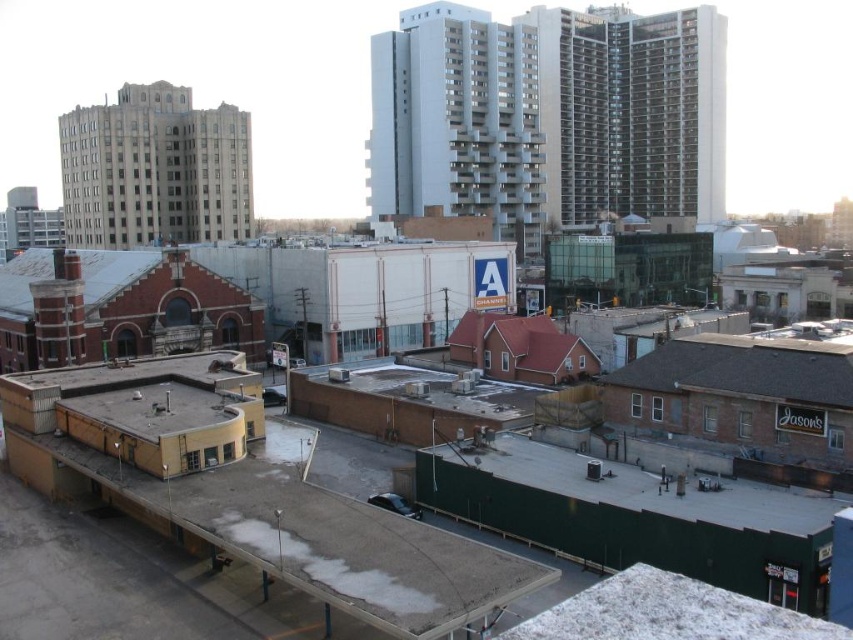
Where is `green matte wall at lower center`? green matte wall at lower center is located at coordinates (646, 486).

Who is more forward, (x=492, y=442) or (x=782, y=385)?

Positioned in front is point (x=782, y=385).

Identify the location of green matte wall at lower center. (646, 486).